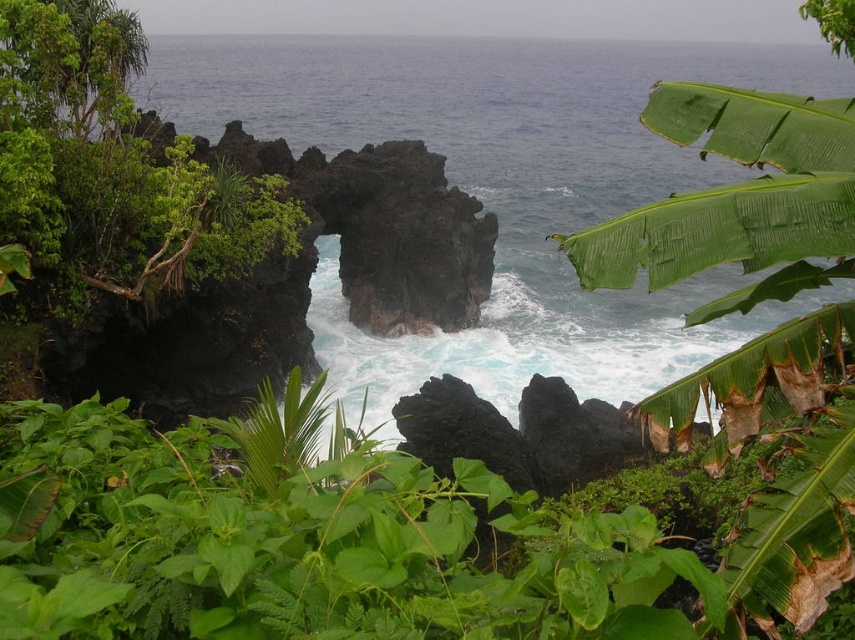
You are standing at the center of the coastal landscape and want to take a photo of both the green leafy banana tree at right and the green leafy shrub at left. Which one is closer to you?

The green leafy banana tree at right is closer to you because it is in front of the green leafy shrub at left.